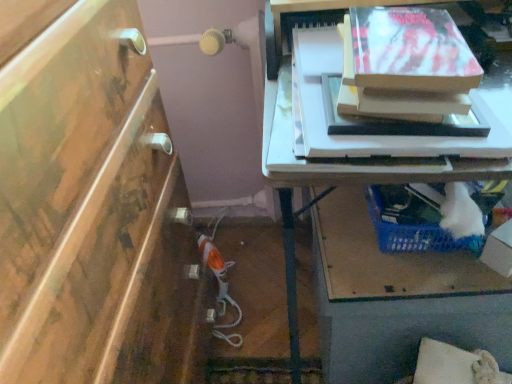
Find the location of a particular element. The image size is (512, 384). white cardboard box at lower right is located at coordinates (499, 250).

Identify the location of white cardboard box at lower right. This screenshot has width=512, height=384. (499, 250).

Is white cardboard box at lower right inside the boundaries of matte cardboard box at upper right, or outside?

white cardboard box at lower right is located beyond the bounds of matte cardboard box at upper right.

Considering the relative sizes of white cardboard box at lower right and matte cardboard box at upper right in the image provided, is white cardboard box at lower right bigger than matte cardboard box at upper right?

Actually, white cardboard box at lower right might be smaller than matte cardboard box at upper right.

Is white cardboard box at lower right at the left side of matte cardboard box at upper right?

No.

From a real-world perspective, which is physically above, white cardboard box at lower right or matte cardboard box at upper right?

From a 3D spatial view, matte cardboard box at upper right is above.

Is blue plastic basket at lower right not inside matte cardboard box at upper right?

Absolutely, blue plastic basket at lower right is external to matte cardboard box at upper right.

Which of these two, blue plastic basket at lower right or matte cardboard box at upper right, stands shorter?

With less height is matte cardboard box at upper right.

Relative to matte cardboard box at upper right, is blue plastic basket at lower right in front or behind?

Clearly, blue plastic basket at lower right is behind matte cardboard box at upper right.

Considering the sizes of objects blue plastic basket at lower right and matte cardboard box at upper right in the image provided, who is bigger, blue plastic basket at lower right or matte cardboard box at upper right?

blue plastic basket at lower right is bigger.

In order to click on vanity below the white cardboard box at lower right (from a real-world perspective) in this screenshot , I will do `click(397, 298)`.

How different are the orientations of white cardboard box at lower right and blue plastic basket at lower right in degrees?

white cardboard box at lower right and blue plastic basket at lower right are facing 32.6 degrees away from each other.

Does white cardboard box at lower right touch blue plastic basket at lower right?

No, white cardboard box at lower right is not making contact with blue plastic basket at lower right.

From a real-world perspective, is blue plastic basket at lower right on white cardboard box at lower right?

No.

Would you say blue plastic basket at lower right is inside or outside white cardboard box at lower right?

The correct answer is: outside.

Which object is positioned more to the right, blue plastic basket at lower right or white cardboard box at lower right?

Positioned to the right is white cardboard box at lower right.

Based on the photo, who is bigger, blue plastic basket at lower right or white cardboard box at lower right?

With larger size is blue plastic basket at lower right.

Identify the location of storage box that appears on the left of blue plastic basket at lower right. This screenshot has width=512, height=384. (407, 51).

From the image's perspective, is matte cardboard box at upper right above or below blue plastic basket at lower right?

matte cardboard box at upper right is situated higher than blue plastic basket at lower right in the image.

Is matte cardboard box at upper right turned away from blue plastic basket at lower right?

No, matte cardboard box at upper right's orientation is not away from blue plastic basket at lower right.

How different are the orientations of matte cardboard box at upper right and white cardboard box at lower right in degrees?

They differ by 42.8 degrees in their facing directions.

Which object is closer to the camera, matte cardboard box at upper right or white cardboard box at lower right?

matte cardboard box at upper right is closer to the camera.

Could you tell me if matte cardboard box at upper right is facing white cardboard box at lower right?

No.

Is white cardboard box at lower right surrounded by matte cardboard box at upper right?

No, matte cardboard box at upper right does not contain white cardboard box at lower right.

The width and height of the screenshot is (512, 384). Identify the location of box on the right of matte cardboard box at upper right. (499, 250).

This screenshot has height=384, width=512. Find the location of `storage box on the left of blue plastic basket at lower right`. storage box on the left of blue plastic basket at lower right is located at coordinates (407, 51).

Estimate the real-world distances between objects in this image. Which object is further from matte cardboard box at upper right, blue plastic basket at lower right or white cardboard box at lower right?

Among the two, blue plastic basket at lower right is located further to matte cardboard box at upper right.

Which object lies nearer to the anchor point matte cardboard box at upper right, white cardboard box at lower right or blue plastic basket at lower right?

white cardboard box at lower right is positioned closer to the anchor matte cardboard box at upper right.

From the image, which object appears to be nearer to white cardboard box at lower right, blue plastic basket at lower right or matte cardboard box at upper right?

Among the two, blue plastic basket at lower right is located nearer to white cardboard box at lower right.

In the scene shown: Estimate the real-world distances between objects in this image. Which object is further from blue plastic basket at lower right, white cardboard box at lower right or matte cardboard box at upper right?

matte cardboard box at upper right is further to blue plastic basket at lower right.

Considering their positions, is matte cardboard box at upper right positioned further to white cardboard box at lower right than blue plastic basket at lower right?

The object further to white cardboard box at lower right is matte cardboard box at upper right.

Which object lies further to the anchor point blue plastic basket at lower right, matte cardboard box at upper right or white cardboard box at lower right?

matte cardboard box at upper right.

Find the location of `box between matte cardboard box at upper right and blue plastic basket at lower right from top to bottom`. box between matte cardboard box at upper right and blue plastic basket at lower right from top to bottom is located at coordinates (499, 250).